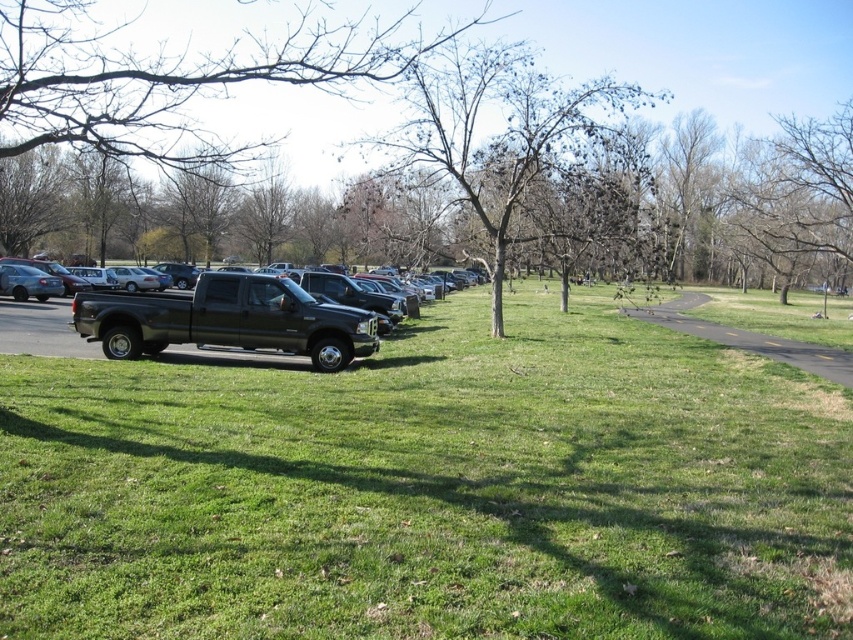
Is point (70, 486) in front of point (579, 108)?

Yes, it is in front of point (579, 108).

Which of these two, green grassy field at center or bare branches at center, stands taller?

bare branches at center is taller.

Is point (769, 483) positioned before point (520, 179)?

That is True.

What are the coordinates of `green grassy field at center` in the screenshot? It's located at (430, 488).

Does point (78, 470) come farther from viewer compared to point (152, 340)?

No, (78, 470) is closer to viewer.

Between green grassy field at center and matte black truck at center, which one appears on the left side from the viewer's perspective?

From the viewer's perspective, matte black truck at center appears more on the left side.

Is point (666, 481) positioned in front of point (148, 304)?

Yes, it is.

Where is `green grassy field at center`? Image resolution: width=853 pixels, height=640 pixels. green grassy field at center is located at coordinates (430, 488).

Is the position of bare branches at center more distant than that of matte black truck at center?

Yes, it is behind matte black truck at center.

Who is higher up, bare branches at center or matte black truck at center?

bare branches at center is above.

Which is in front, point (432, 124) or point (334, 353)?

Point (334, 353) is more forward.

Locate an element on the screen. This screenshot has height=640, width=853. bare branches at center is located at coordinates (498, 132).